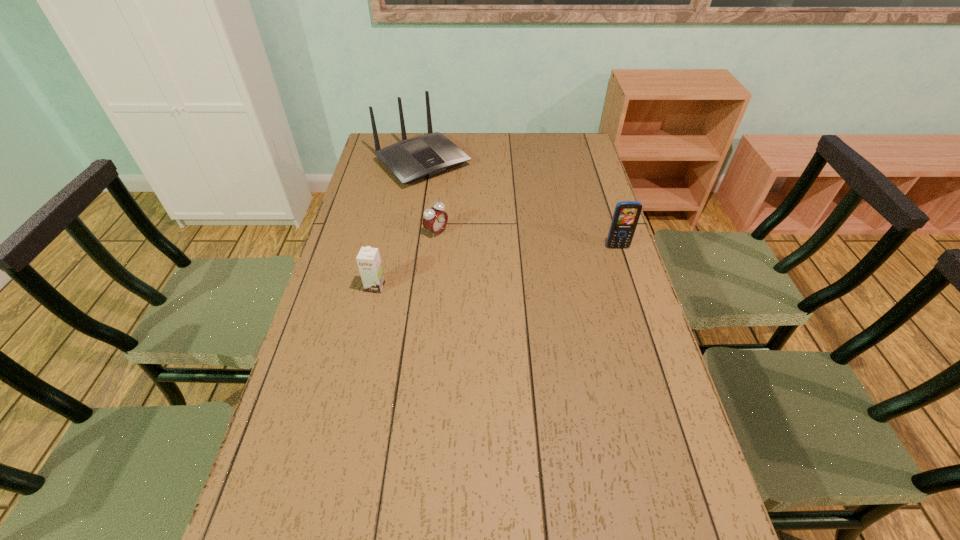
Where is `object that is at the far left corner`? The width and height of the screenshot is (960, 540). object that is at the far left corner is located at coordinates (428, 155).

Where is `vacant region at the far edge`? vacant region at the far edge is located at coordinates (544, 146).

In the image, there is a desktop. Where is `vacant space at the near edge`? Image resolution: width=960 pixels, height=540 pixels. vacant space at the near edge is located at coordinates (568, 518).

Locate an element on the screen. free region at the left edge of the desktop is located at coordinates (338, 313).

I want to click on free space at the right edge of the desktop, so click(x=616, y=263).

In order to click on free space at the far left corner in this screenshot , I will do `click(369, 154)`.

The height and width of the screenshot is (540, 960). Identify the location of free space at the far right corner. pyautogui.click(x=559, y=133).

In the image, there is a desktop. Where is `vacant space at the near right corner`? vacant space at the near right corner is located at coordinates (637, 491).

You are a GUI agent. You are given a task and a screenshot of the screen. Output one action in this format:
    pyautogui.click(x=<x>, y=<y>)
    Task: Click on the vacant area between the chocolate milk and the router
    Image resolution: width=960 pixels, height=540 pixels.
    Given the screenshot: What is the action you would take?
    pyautogui.click(x=399, y=225)

You are a GUI agent. You are given a task and a screenshot of the screen. Output one action in this format:
    pyautogui.click(x=<x>, y=<y>)
    Task: Click on the vacant area that lies between the second nearest object and the router
    This screenshot has height=540, width=960.
    Given the screenshot: What is the action you would take?
    pyautogui.click(x=520, y=205)